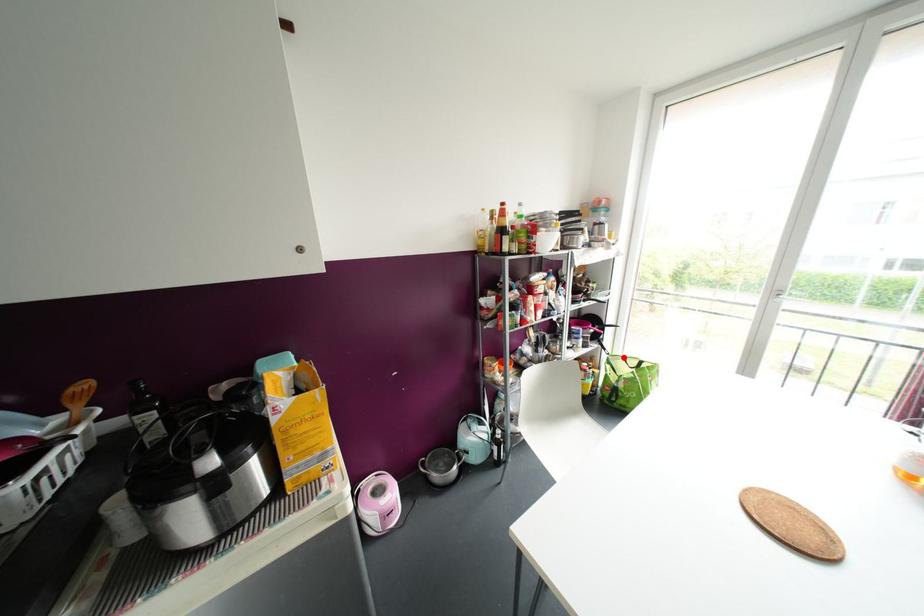
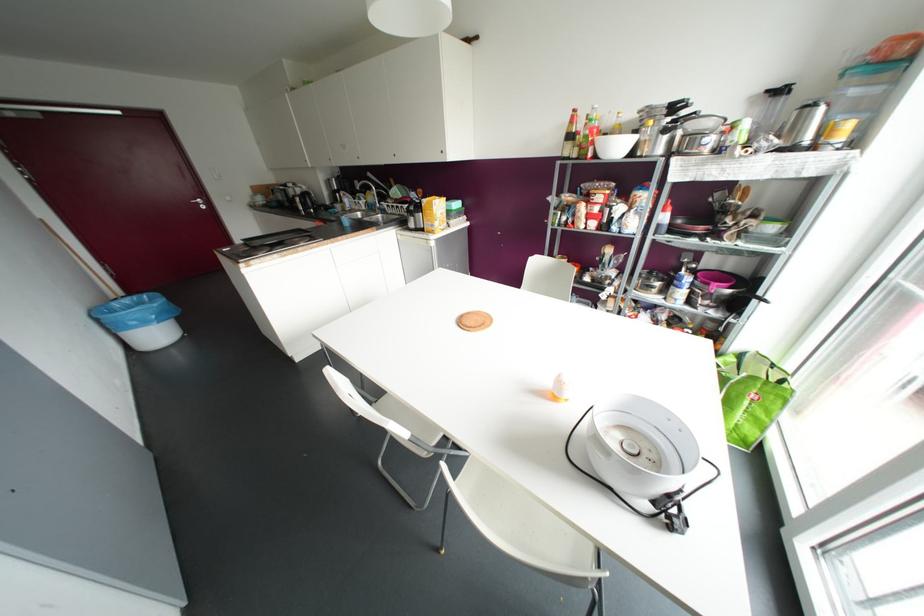
Find the pixel in the second image that matches the highlighted location in the first image.

(772, 365)